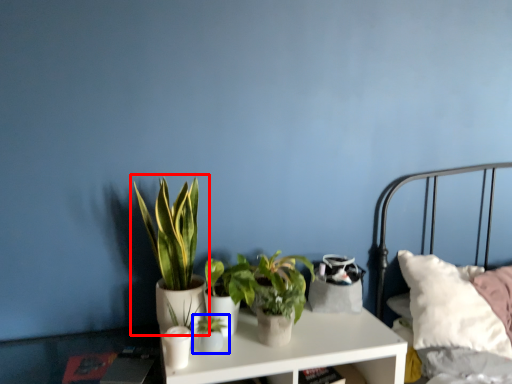
Question: Which object is further to the camera taking this photo, houseplant (highlighted by a red box) or houseplant (highlighted by a blue box)?

Choices:
 (A) houseplant
 (B) houseplant

Answer: (B)